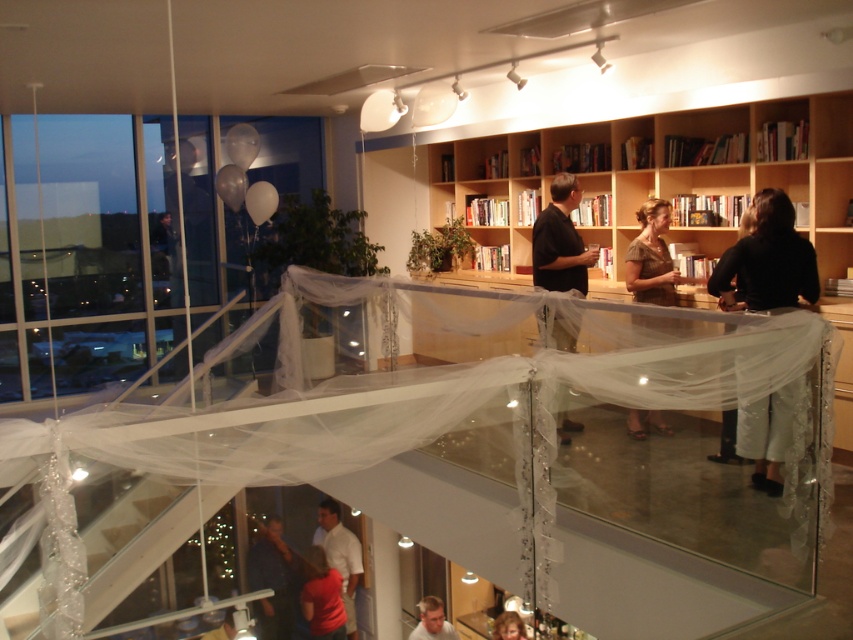
Question: Can you confirm if black fabric pants at right is positioned above brown fabric dress at center?

Choices:
 (A) yes
 (B) no

Answer: (B)

Question: Which object appears farthest from the camera in this image?

Choices:
 (A) black fabric pants at right
 (B) white matte shirt at lower center
 (C) matte red shirt at lower center
 (D) black matte shirt at center

Answer: (C)

Question: Does wooden bookshelf at center come behind black fabric pants at right?

Choices:
 (A) yes
 (B) no

Answer: (A)

Question: Can you confirm if brown fabric dress at center is positioned to the right of dark blue shirt at lower center?

Choices:
 (A) no
 (B) yes

Answer: (B)

Question: Which object is closer to the camera taking this photo?

Choices:
 (A) matte red shirt at lower center
 (B) light brown hair at lower center
 (C) brown fabric dress at center

Answer: (C)

Question: Which point is closer to the camera?

Choices:
 (A) brown fabric dress at center
 (B) wooden bookshelf at center
 (C) blonde hair at lower center
 (D) black matte shirt at center

Answer: (B)